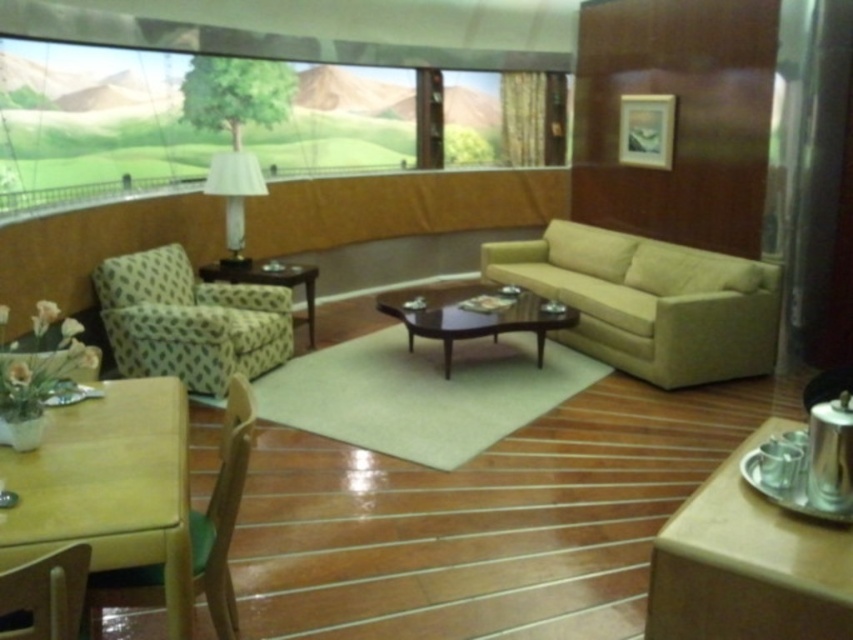
Based on the photo, you are standing in the living room and want to place a decorative vase on the dark wood finish coffee table at center. Given that the coffee table is at point (462, 317), can you confirm if this location is directly in front of the large window with the scenic view?

The dark wood finish coffee table at center is located at point (462, 317). Since the large window is described as being in the background of the scene, the coffee table is positioned in the center of the room, which is likely not directly in front of the window. Therefore, placing the vase there would not be directly under the window view.